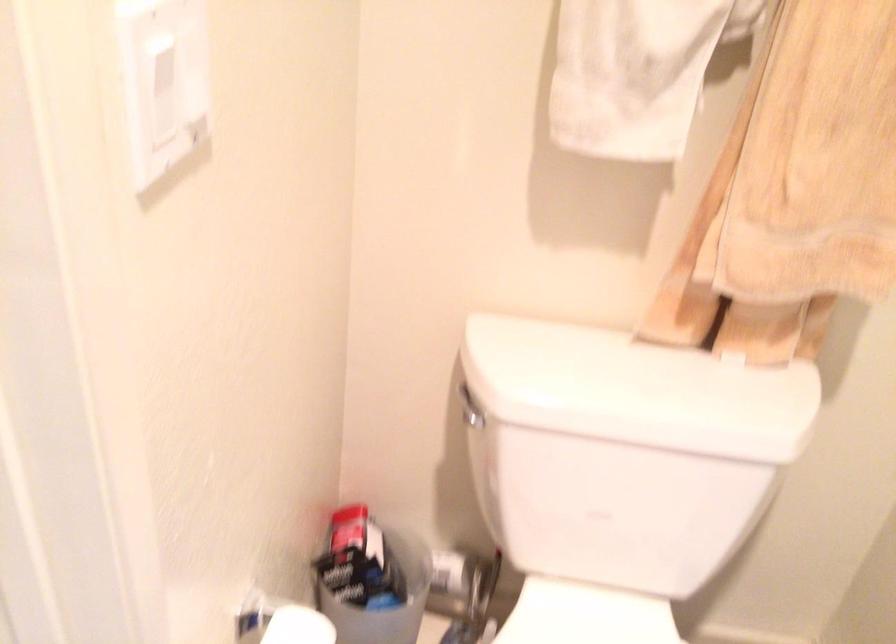
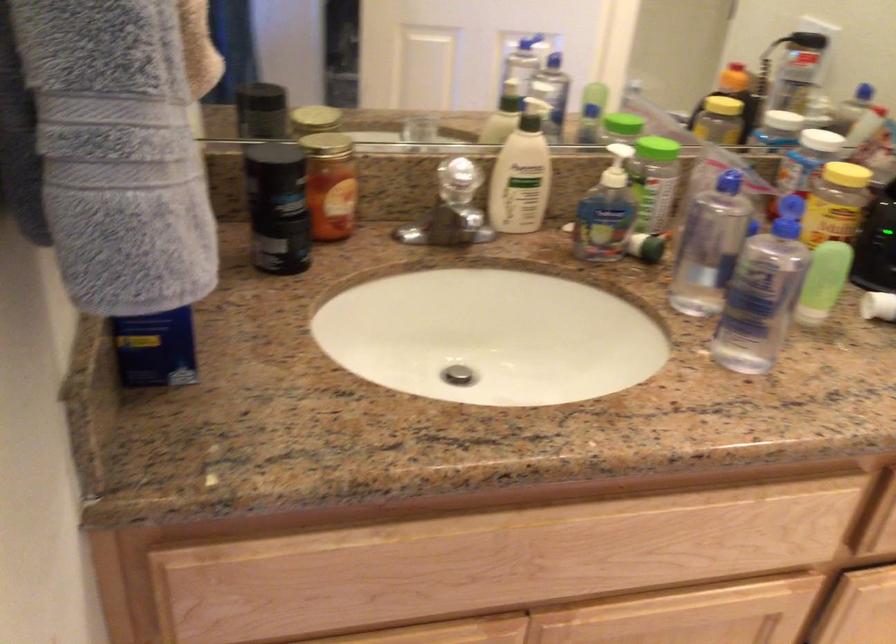
Question: Which direction would the cameraman need to move to produce the second image? Reply with the corresponding letter.

Choices:
 (A) Left
 (B) Right
 (C) Forward
 (D) Backward

Answer: (A)